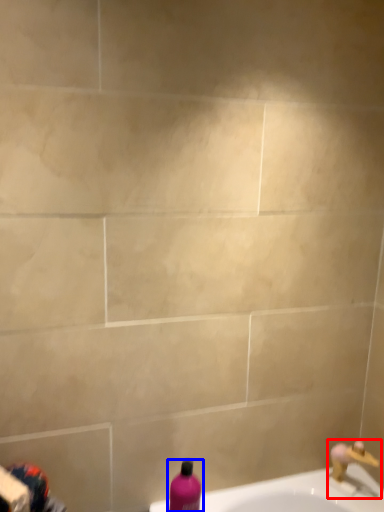
Question: Which of the following is the farthest to the observer, tap (highlighted by a red box) or bottle (highlighted by a blue box)?

Choices:
 (A) tap
 (B) bottle

Answer: (A)